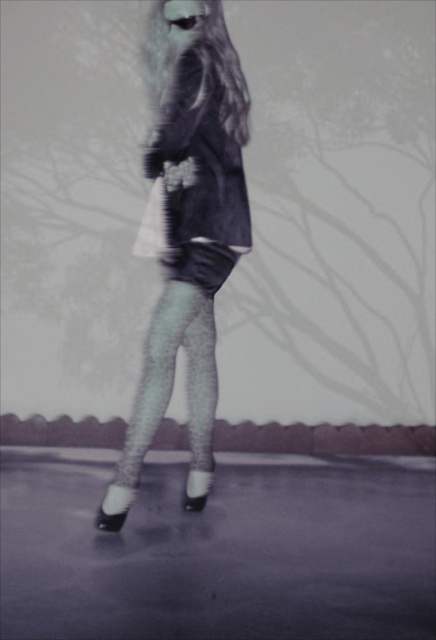
Can you confirm if fluffy black coat at center is positioned to the left of glittery tights at center?

Incorrect, fluffy black coat at center is not on the left side of glittery tights at center.

What do you see at coordinates (190, 237) in the screenshot?
I see `fluffy black coat at center` at bounding box center [190, 237].

Is point (173, 65) farther from viewer compared to point (190, 307)?

No, (173, 65) is in front of (190, 307).

This screenshot has height=640, width=436. In order to click on fluffy black coat at center in this screenshot , I will do `click(190, 237)`.

Does fluffy black coat at center have a greater width compared to fuzzy black dress at center?

Indeed, fluffy black coat at center has a greater width compared to fuzzy black dress at center.

Is fluffy black coat at center closer to the viewer compared to fuzzy black dress at center?

That is False.

Does point (164, 282) come closer to viewer compared to point (200, 120)?

No, it is behind (200, 120).

In order to click on fluffy black coat at center in this screenshot , I will do `click(190, 237)`.

Who is positioned more to the left, fuzzy black dress at center or glittery tights at center?

glittery tights at center

Does fuzzy black dress at center appear on the left side of glittery tights at center?

In fact, fuzzy black dress at center is to the right of glittery tights at center.

This screenshot has height=640, width=436. What do you see at coordinates (203, 168) in the screenshot?
I see `fuzzy black dress at center` at bounding box center [203, 168].

This screenshot has height=640, width=436. What are the coordinates of `fuzzy black dress at center` in the screenshot? It's located at (203, 168).